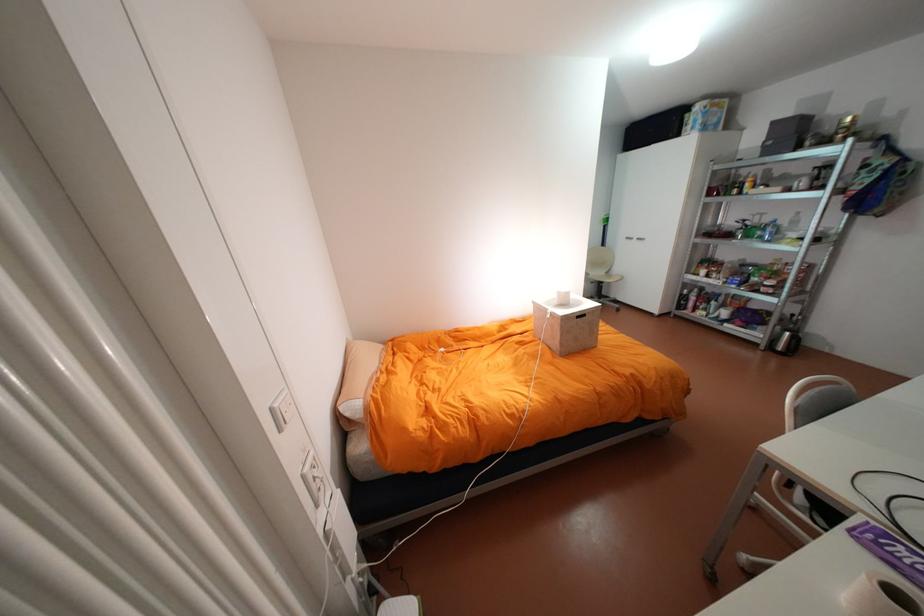
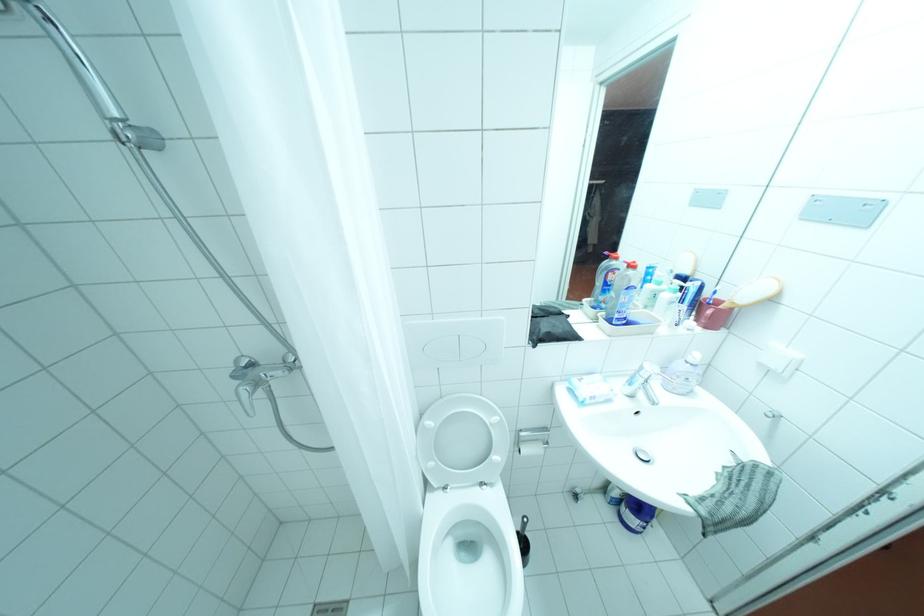
Question: Which direction would the cameraman need to move to produce the second image? Reply with the corresponding letter.

Choices:
 (A) Left
 (B) Right
 (C) Forward
 (D) Backward

Answer: (C)